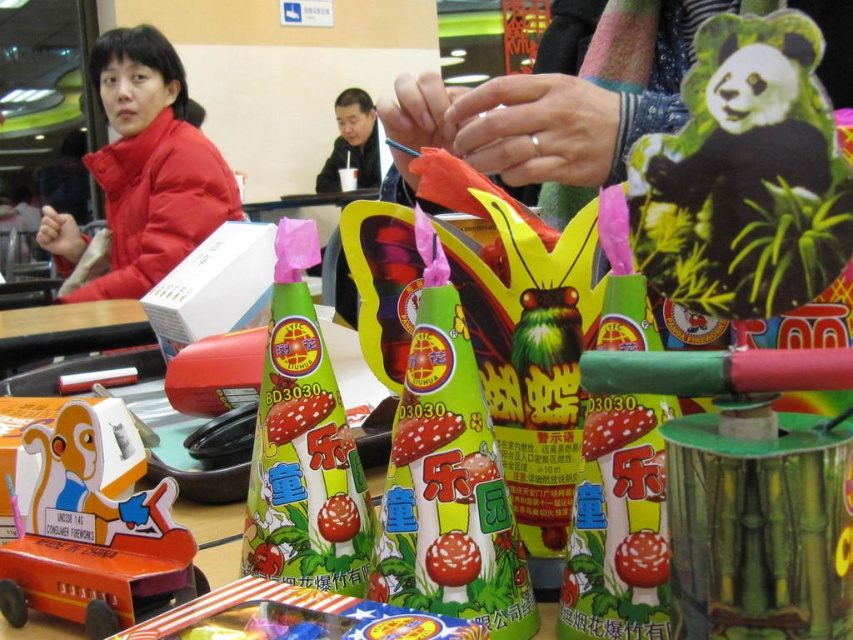
Question: Can you confirm if black plush panda at upper right is bigger than green matte toy at center?

Choices:
 (A) no
 (B) yes

Answer: (A)

Question: Which object appears closest to the camera in this image?

Choices:
 (A) wooden toy car at center
 (B) green matte toy at center

Answer: (A)

Question: Which object appears closest to the camera in this image?

Choices:
 (A) black plush panda at upper right
 (B) green matte toy at center
 (C) matte black jacket at upper center

Answer: (A)

Question: Is wooden toy car at center smaller than matte black jacket at upper center?

Choices:
 (A) yes
 (B) no

Answer: (A)

Question: Does matte red jacket at upper left appear over matte black jacket at upper center?

Choices:
 (A) yes
 (B) no

Answer: (B)

Question: Which of the following is the closest to the observer?

Choices:
 (A) (207, 584)
 (B) (149, 29)

Answer: (A)